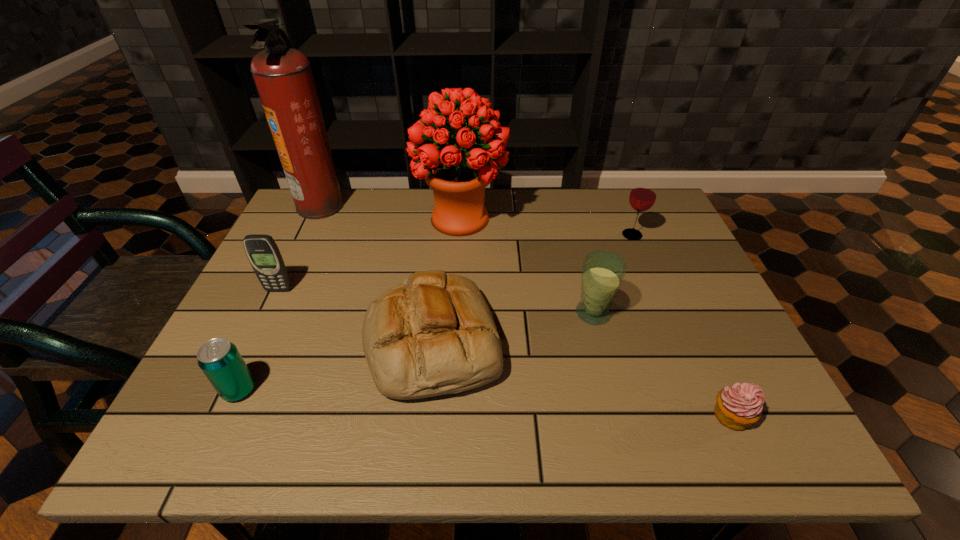
In the image, there is a desktop. At what (x,y) coordinates should I click in order to perform the action: click on vacant space at the near edge. Please return your answer as a coordinate pair (x, y). The height and width of the screenshot is (540, 960). Looking at the image, I should click on (571, 426).

Find the location of a particular element. The image size is (960, 540). free space at the left edge is located at coordinates (233, 333).

In the image, there is a desktop. At what (x,y) coordinates should I click in order to perform the action: click on vacant region at the far right corner. Please return your answer as a coordinate pair (x, y). Image resolution: width=960 pixels, height=540 pixels. Looking at the image, I should click on (677, 225).

At what (x,y) coordinates should I click in order to perform the action: click on free space between the tallest object and the sixth object from left to right. Please return your answer as a coordinate pair (x, y). The height and width of the screenshot is (540, 960). Looking at the image, I should click on (457, 259).

Find the location of a particular element. This screenshot has width=960, height=540. vacant region between the nearer glass and the fire extinguisher is located at coordinates (457, 259).

At what (x,y) coordinates should I click in order to perform the action: click on free space between the second tallest object and the right glass. Please return your answer as a coordinate pair (x, y). This screenshot has width=960, height=540. Looking at the image, I should click on (546, 227).

This screenshot has height=540, width=960. In order to click on vacant point located between the shortest object and the farther glass in this screenshot , I will do `click(682, 326)`.

Locate an element on the screen. This screenshot has height=540, width=960. free space between the cellular telephone and the bread is located at coordinates (355, 316).

You are a GUI agent. You are given a task and a screenshot of the screen. Output one action in this format:
    pyautogui.click(x=<x>, y=<y>)
    Task: Click on the blank region between the cupcake and the cellular telephone
    This screenshot has height=540, width=960.
    Given the screenshot: What is the action you would take?
    pyautogui.click(x=505, y=353)

Where is `vacant area between the nearer glass and the tallest object`? vacant area between the nearer glass and the tallest object is located at coordinates (457, 259).